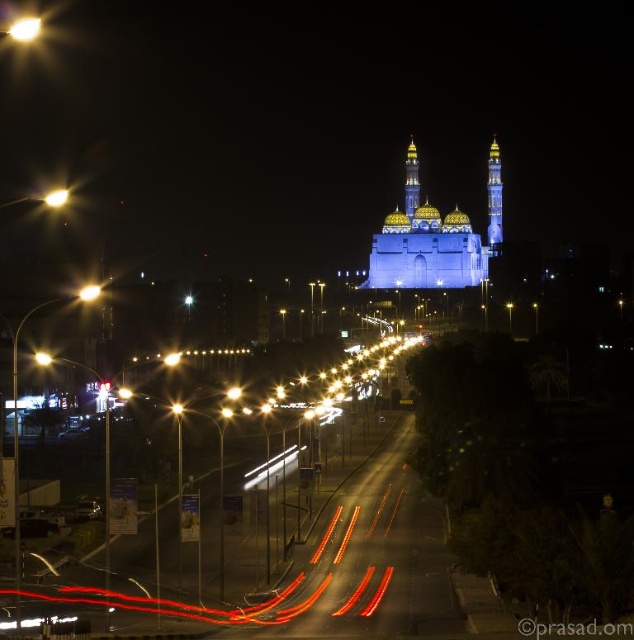
Locate an element on the screen. This screenshot has height=640, width=634. matte glass traffic light at left is located at coordinates (89, 291).

Is matte glass traffic light at left positioned before yellow metallic streetlight at upper left?

No, matte glass traffic light at left is further to the viewer.

Is point (94, 289) positioned behind point (41, 362)?

Yes, point (94, 289) is behind point (41, 362).

Identify the location of matte glass traffic light at left. (89, 291).

Could you measure the distance between metallic streetlight at upper left and yellow metallic streetlight at upper left?

A distance of 221.64 feet exists between metallic streetlight at upper left and yellow metallic streetlight at upper left.

Which is below, metallic streetlight at upper left or yellow metallic streetlight at upper left?

yellow metallic streetlight at upper left is below.

What do you see at coordinates (23, 28) in the screenshot? This screenshot has height=640, width=634. I see `metallic streetlight at upper left` at bounding box center [23, 28].

Locate an element on the screen. metallic streetlight at upper left is located at coordinates (23, 28).

Does blue illuminated mosque at center appear on the right side of bright yellow streetlight at center?

Correct, you'll find blue illuminated mosque at center to the right of bright yellow streetlight at center.

Who is taller, blue illuminated mosque at center or bright yellow streetlight at center?

With more height is blue illuminated mosque at center.

Identify the location of blue illuminated mosque at center. (424, 244).